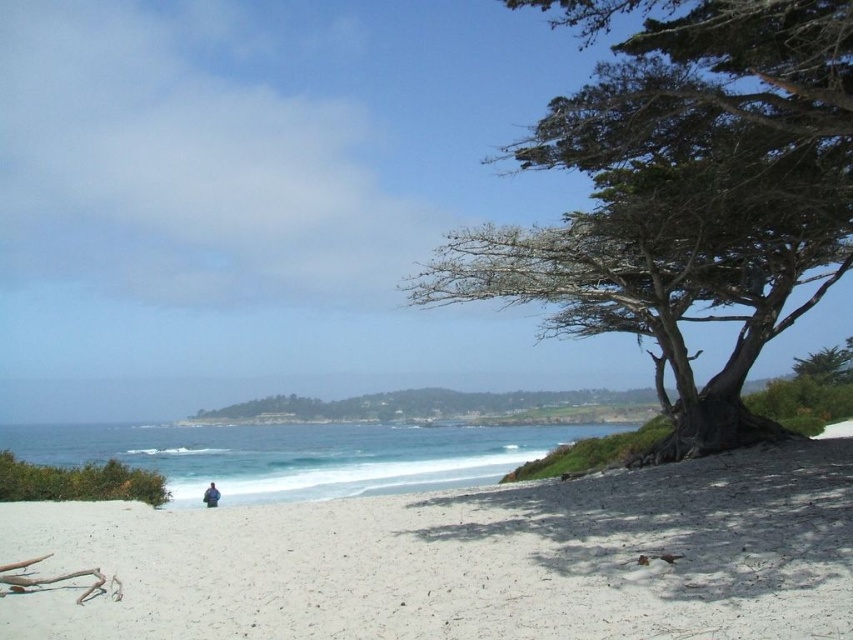
Consider the image. Can you confirm if white sand at lower center is positioned above green textured tree at upper right?

→ No.

Identify the location of white sand at lower center. (468, 560).

Can you confirm if white sand at lower center is positioned above purple fabric person at lower center?

Indeed, white sand at lower center is positioned over purple fabric person at lower center.

Is point (318, 586) positioned before point (216, 492)?

Yes.

This screenshot has height=640, width=853. I want to click on white sand at lower center, so click(x=468, y=560).

Between green leafy bush at lower left and purple fabric person at lower center, which one appears on the right side from the viewer's perspective?

purple fabric person at lower center

Can you confirm if green leafy bush at lower left is positioned above purple fabric person at lower center?

Indeed, green leafy bush at lower left is positioned over purple fabric person at lower center.

The height and width of the screenshot is (640, 853). Find the location of `green leafy bush at lower left`. green leafy bush at lower left is located at coordinates pos(78,481).

I want to click on green leafy bush at lower left, so click(78, 481).